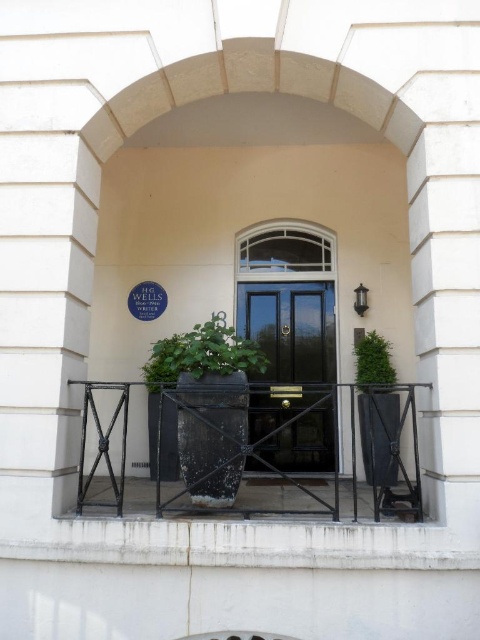
Question: Which object is farther from the camera taking this photo?

Choices:
 (A) green leafy plant at right
 (B) green leafy plant at center

Answer: (A)

Question: Is black polished wood door at center positioned at the back of green leafy plant at center?

Choices:
 (A) no
 (B) yes

Answer: (B)

Question: Estimate the real-world distances between objects in this image. Which object is farther from the black wrought iron rail at center?

Choices:
 (A) black polished wood door at center
 (B) green leafy plant at center

Answer: (B)

Question: Is black wrought iron rail at center smaller than black polished wood door at center?

Choices:
 (A) yes
 (B) no

Answer: (B)

Question: Observing the image, what is the correct spatial positioning of black wrought iron rail at center in reference to green leafy plant at center?

Choices:
 (A) right
 (B) left

Answer: (A)

Question: Among these objects, which one is nearest to the camera?

Choices:
 (A) green leafy plant at right
 (B) black polished wood door at center
 (C) green leafy plant at center

Answer: (C)